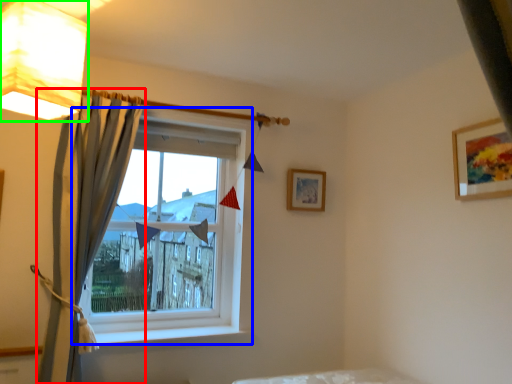
Question: Which object is positioned farthest from curtain (highlighted by a red box)? Select from window (highlighted by a blue box) and lamp (highlighted by a green box).

Choices:
 (A) window
 (B) lamp

Answer: (B)